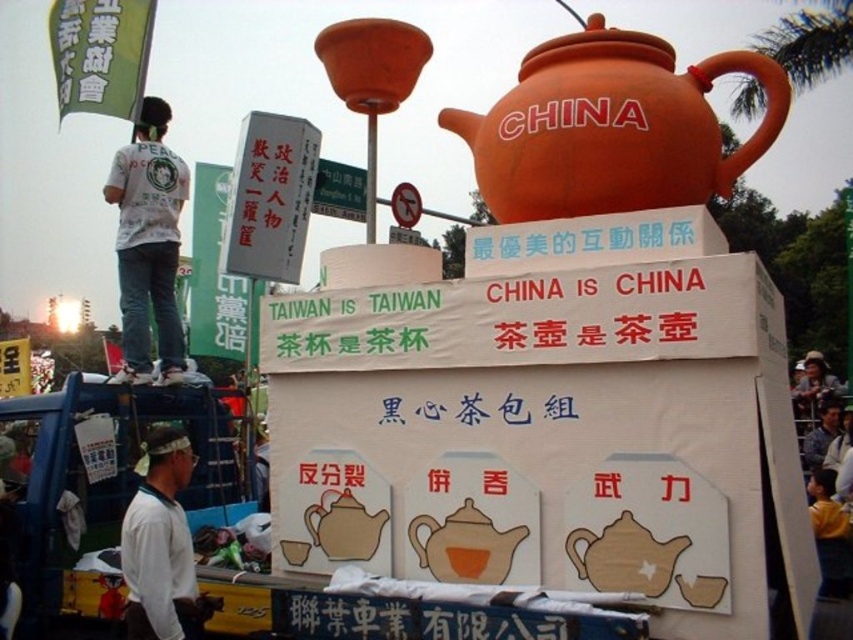
Question: Is matte orange clay teapot at upper center wider than matte brown teapot at center?

Choices:
 (A) yes
 (B) no

Answer: (A)

Question: Observing the image, what is the correct spatial positioning of white cotton shirt at left in reference to white fabric at lower left?

Choices:
 (A) above
 (B) below

Answer: (A)

Question: Does matte orange teapot at center appear under blue denim shirt at lower right?

Choices:
 (A) yes
 (B) no

Answer: (B)

Question: Which of these objects is positioned farthest from the matte orange teapot at center?

Choices:
 (A) white fabric at lower left
 (B) blue denim shirt at lower right
 (C) matte brown teapot at center

Answer: (B)

Question: Which of these objects is positioned farthest from the white fabric at lower left?

Choices:
 (A) white cotton shirt at left
 (B) matte orange teapot at center

Answer: (A)

Question: Which point is closer to the camera?

Choices:
 (A) (138, 461)
 (B) (776, 104)

Answer: (A)